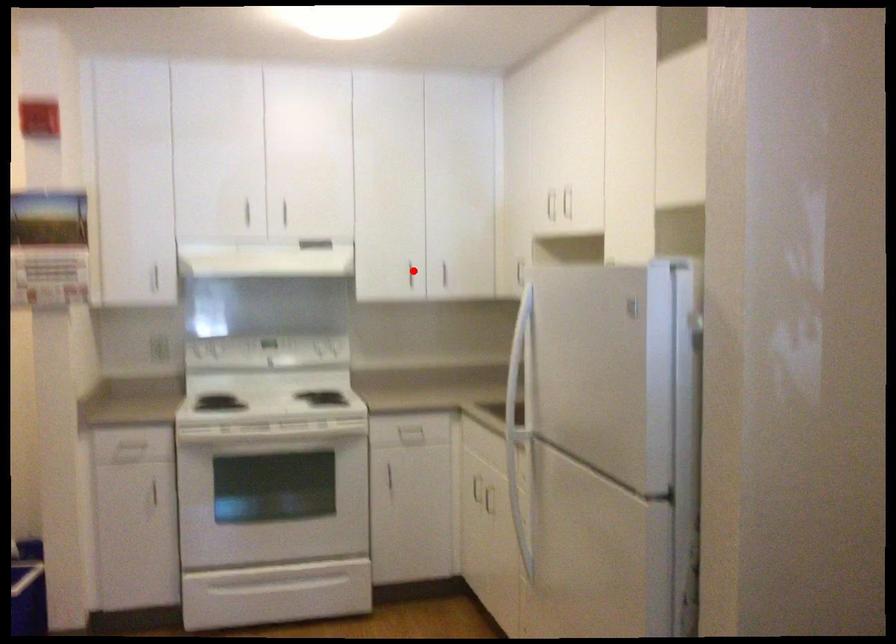
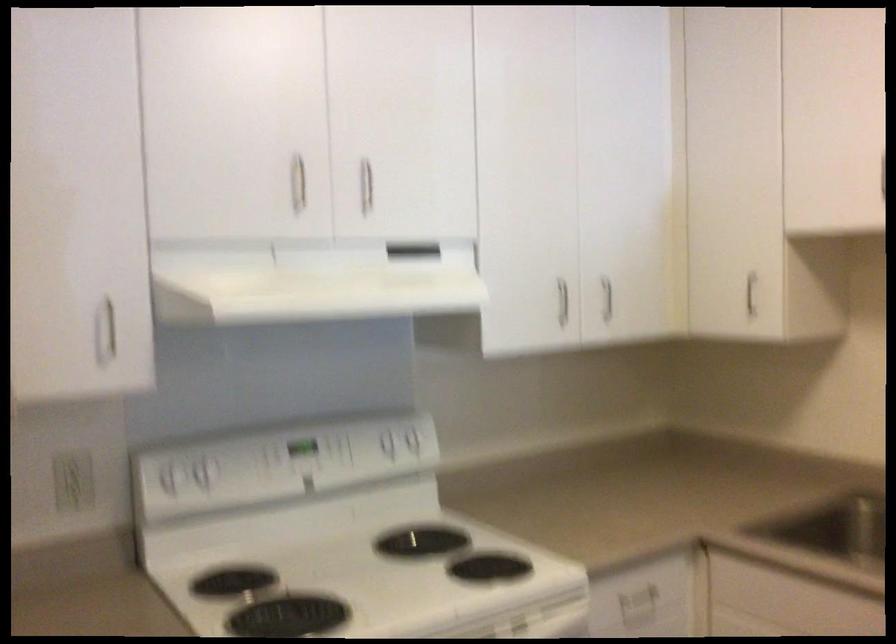
Question: I am providing you with two images of the same scene from different viewpoints. Given a red point in image1, look at the same physical point in image2. Is it:

Choices:
 (A) Closer to the viewpoint
 (B) Farther from the viewpoint

Answer: (A)